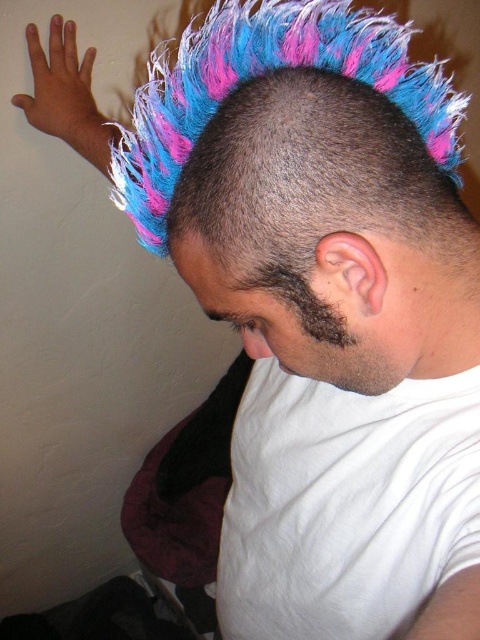
You are a photographer setting up a lighting setup for a portrait. You need to ensure that the shiny multicolored mohawk at center and the dark brown fuzzy beard at lower right are both well lit. Given that the mohawk is wider than the beard, which object requires a wider light source to capture its full width?

The shiny multicolored mohawk at center requires a wider light source because its width is larger than the dark brown fuzzy beard at lower right.

You are a photographer setting up a portrait shoot. You need to position a spotlight to highlight both the shiny multicolored mohawk at center and the dark brown fuzzy beard at lower right. Given their heights, which object should be placed closer to the light source to ensure both are equally illuminated?

The shiny multicolored mohawk at center is much taller than the dark brown fuzzy beard at lower right. To ensure both are equally illuminated, the dark brown fuzzy beard at lower right should be placed closer to the light source since it is shorter and needs more light intensity to match the illumination of the taller mohawk.

You are an artist trying to sketch this person. You need to place the shiny multicolored mohawk at center in your drawing. Where exactly should you position it on your canvas, using the coordinate system where the bottom left corner is the origin point?

The shiny multicolored mohawk at center should be positioned at the coordinate point of 0.367 on the x axis and 0.683 on the y axis, according to the given 2D location.